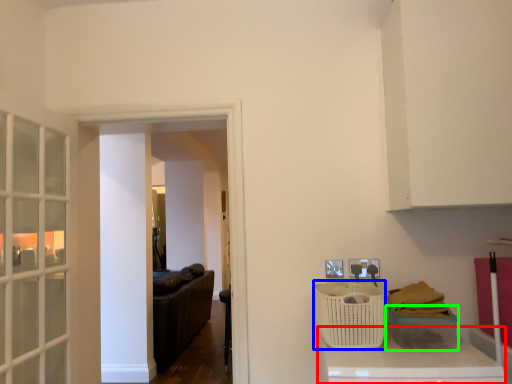
Question: Which object is positioned closest to counter top (highlighted by a red box)? Select from basket (highlighted by a blue box) and basket (highlighted by a green box).

Choices:
 (A) basket
 (B) basket

Answer: (B)